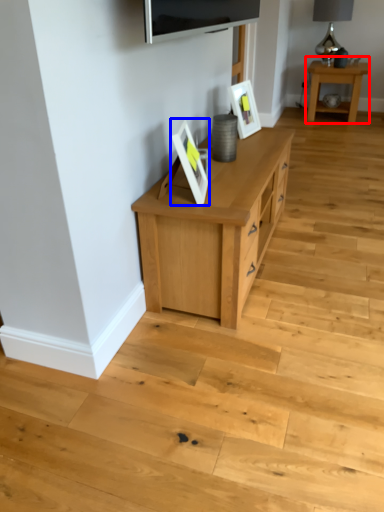
Question: Which object is further to the camera taking this photo, table (highlighted by a red box) or picture frame (highlighted by a blue box)?

Choices:
 (A) table
 (B) picture frame

Answer: (A)